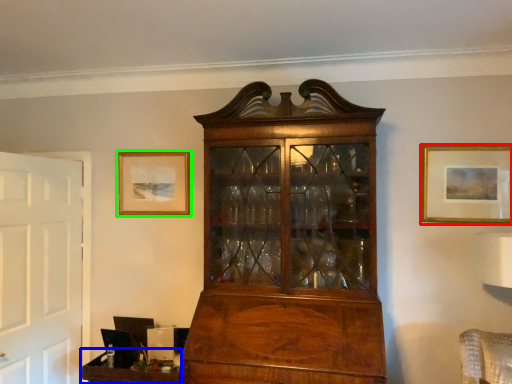
Question: Estimate the real-world distances between objects in this image. Which object is closer to picture frame (highlighted by a red box), table (highlighted by a blue box) or picture frame (highlighted by a green box)?

Choices:
 (A) table
 (B) picture frame

Answer: (B)